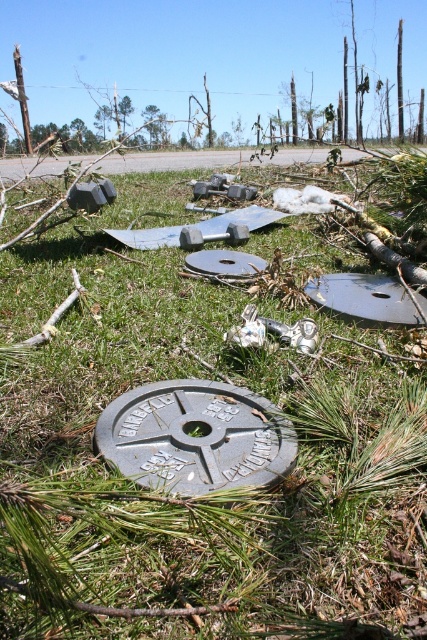
Question: Is black rubber manhole cover at center thinner than black metallic manhole cover at center?

Choices:
 (A) yes
 (B) no

Answer: (B)

Question: Does green leafy tree at upper center have a lesser width compared to gray metallic manhole cover at center?

Choices:
 (A) no
 (B) yes

Answer: (A)

Question: Does black metallic manhole cover at center appear on the left side of gray metallic manhole cover at center?

Choices:
 (A) no
 (B) yes

Answer: (A)

Question: Among these objects, which one is farthest from the camera?

Choices:
 (A) gray metallic manhole cover at center
 (B) green leafy tree at upper center
 (C) black metallic manhole cover at center
 (D) black rubber manhole cover at center

Answer: (B)

Question: Which point appears farthest from the camera in this image?

Choices:
 (A) [x=225, y=275]
 (B) [x=152, y=132]
 (C) [x=207, y=428]
 (D) [x=394, y=323]

Answer: (B)

Question: Which object appears closest to the camera in this image?

Choices:
 (A) gray metallic manhole cover at center
 (B) black rubber manhole cover at center
 (C) green leafy tree at upper center

Answer: (A)